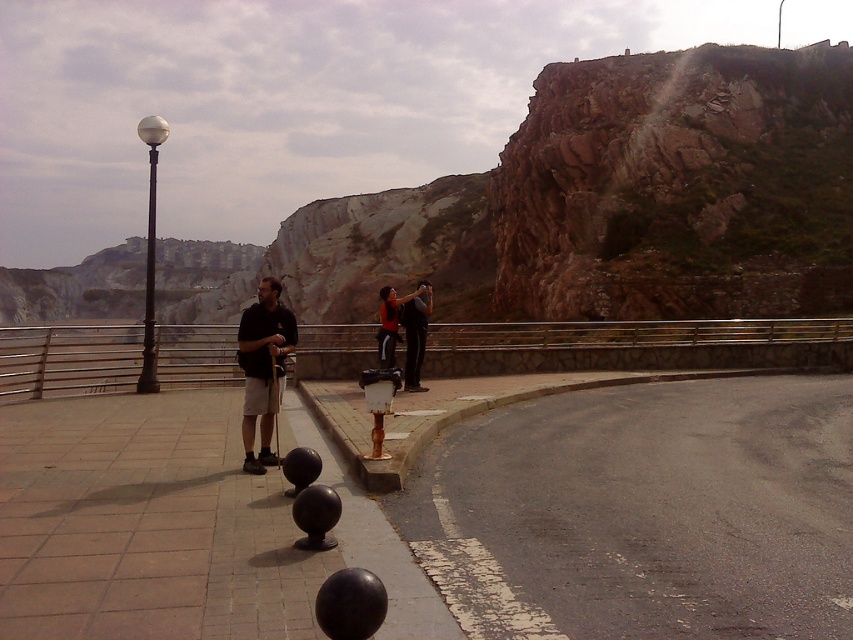
Question: Among these objects, which one is nearest to the camera?

Choices:
 (A) rugged rock cliff at upper right
 (B) dark gray pants at center

Answer: (B)

Question: Does dark gray pants at center appear over matte black jacket at center?

Choices:
 (A) yes
 (B) no

Answer: (B)

Question: Which of these objects is positioned closest to the matte black jacket at center?

Choices:
 (A) rugged rock cliff at upper right
 (B) dark gray pants at center
 (C) black matte shirt at center

Answer: (B)

Question: Is rugged rock cliff at upper right smaller than matte black jacket at center?

Choices:
 (A) yes
 (B) no

Answer: (B)

Question: Is dark gray pants at center closer to camera compared to matte black jacket at center?

Choices:
 (A) yes
 (B) no

Answer: (B)

Question: Which of the following is the farthest from the observer?

Choices:
 (A) dark gray pants at center
 (B) black matte shirt at center
 (C) black metal bollards at center
 (D) matte black jacket at center

Answer: (A)